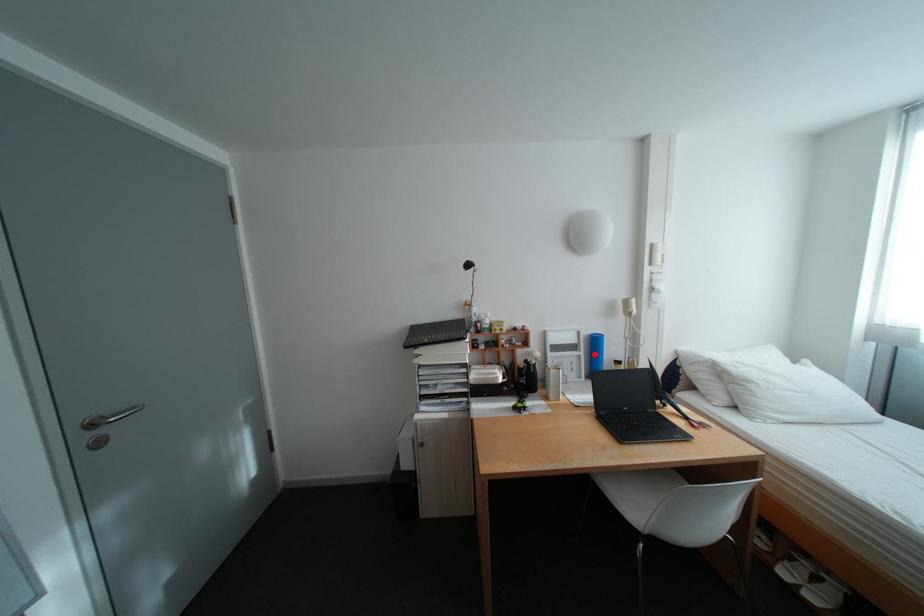
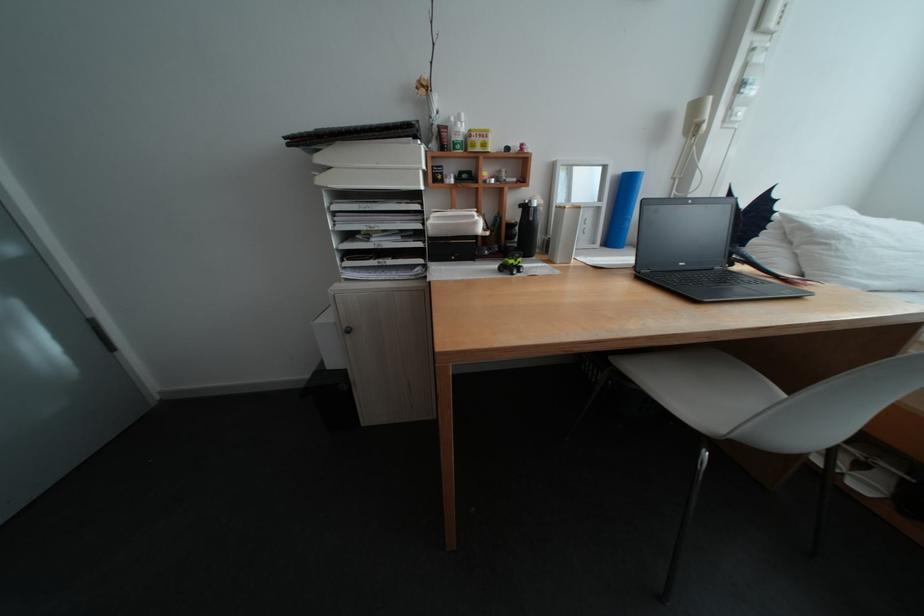
Locate, in the second image, the point that corresponds to the highlighted location in the first image.

(616, 205)